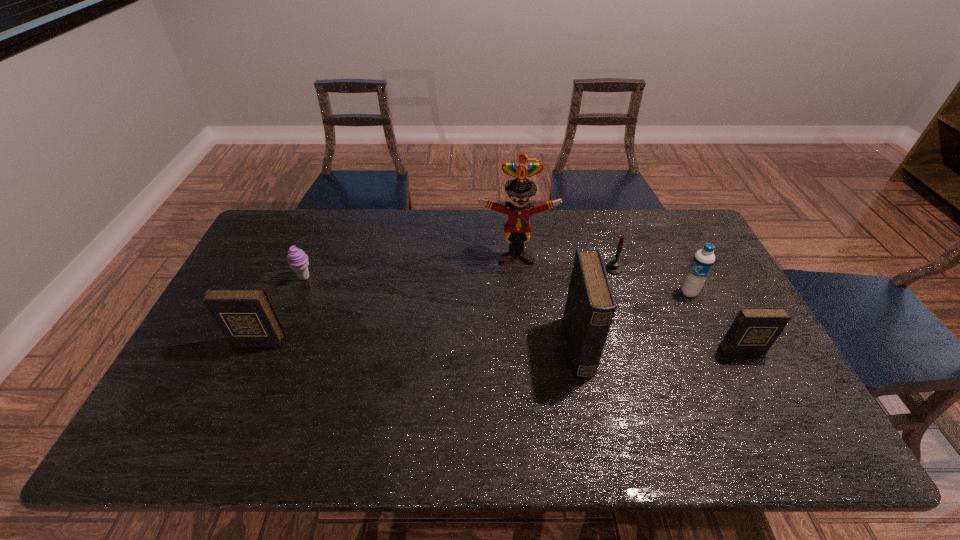
Find the location of a particular element. vacant space in between the third object from right to left and the icecream is located at coordinates (459, 273).

The image size is (960, 540). In order to click on free space between the leftmost diary and the icecream in this screenshot , I will do `click(281, 309)`.

Locate an element on the screen. free space between the second shortest diary and the tallest object is located at coordinates (387, 299).

Find the location of `vacant area that lies between the fourth farthest object and the rightmost diary`. vacant area that lies between the fourth farthest object and the rightmost diary is located at coordinates (715, 321).

The image size is (960, 540). What are the coordinates of `free space between the shortest diary and the tallest object` in the screenshot? It's located at (629, 302).

Choose which object is the fourth nearest neighbor to the icecream. Please provide its 2D coordinates. Your answer should be formatted as a tuple, i.e. [(x, y)], where the tuple contains the x and y coordinates of a point satisfying the conditions above.

[(614, 267)]

Select which object is the closest to the leftmost diary. Please provide its 2D coordinates. Your answer should be formatted as a tuple, i.e. [(x, y)], where the tuple contains the x and y coordinates of a point satisfying the conditions above.

[(297, 259)]

Choose which diary is the second nearest neighbor to the fourth nearest object. Please provide its 2D coordinates. Your answer should be formatted as a tuple, i.e. [(x, y)], where the tuple contains the x and y coordinates of a point satisfying the conditions above.

[(590, 306)]

Point out which diary is positioned as the third nearest to the icecream. Please provide its 2D coordinates. Your answer should be formatted as a tuple, i.e. [(x, y)], where the tuple contains the x and y coordinates of a point satisfying the conditions above.

[(754, 330)]